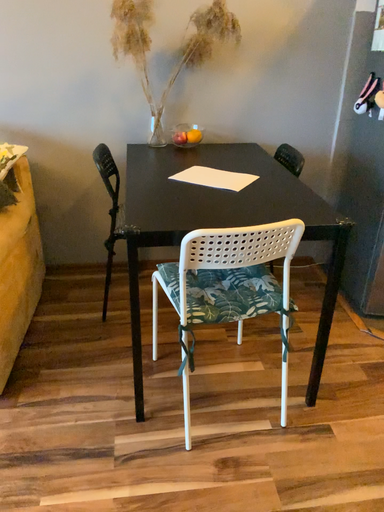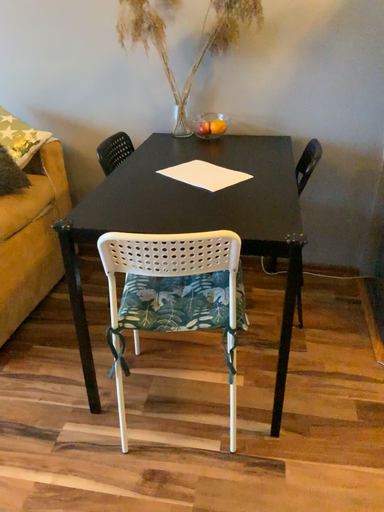
Question: How did the camera likely rotate when shooting the video?

Choices:
 (A) rotated left
 (B) rotated right

Answer: (A)